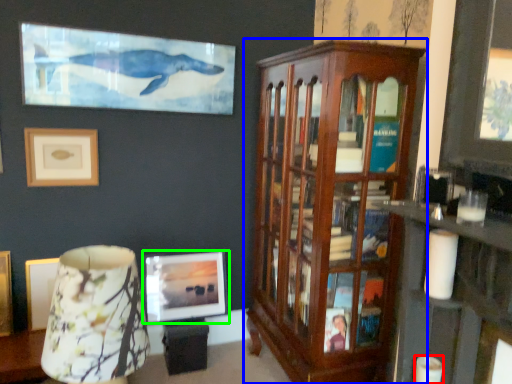
Question: Which is farther away from candle (highlighted by a red box)? cabinetry (highlighted by a blue box) or picture frame (highlighted by a green box)?

Choices:
 (A) cabinetry
 (B) picture frame

Answer: (B)